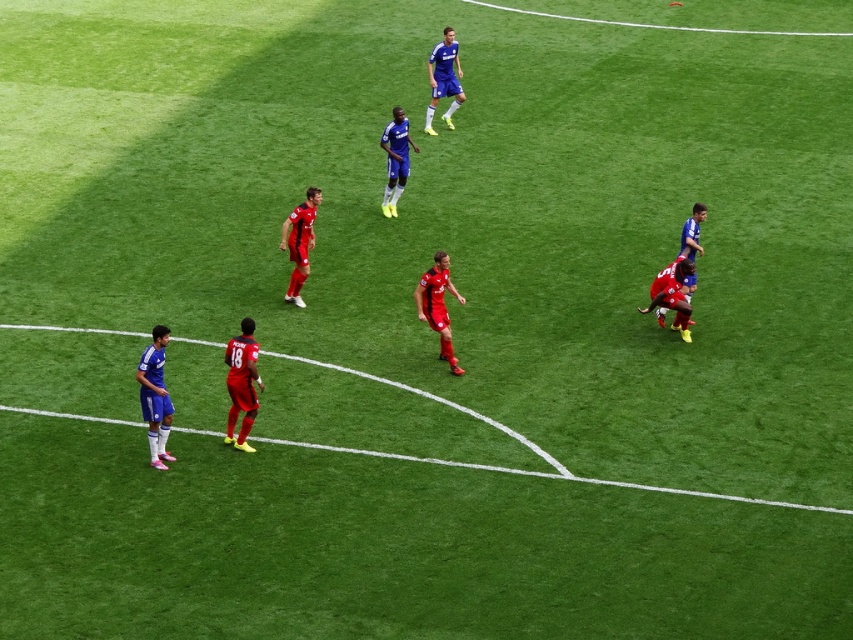
Question: Is blue jersey at lower left below shiny red soccer player at center?

Choices:
 (A) yes
 (B) no

Answer: (A)

Question: Is shiny red jersey at center below matte blue soccer player at center?

Choices:
 (A) yes
 (B) no

Answer: (A)

Question: From the image, what is the correct spatial relationship of shiny red jersey at center in relation to shiny red soccer player at center?

Choices:
 (A) left
 (B) right

Answer: (B)

Question: Which point is closer to the camera?

Choices:
 (A) (236, 417)
 (B) (434, 285)

Answer: (A)

Question: Which point is closer to the camera?

Choices:
 (A) shiny red shorts at center
 (B) matte blue soccer player at center
 (C) shiny red shorts at lower left
 (D) shiny red soccer player at center

Answer: (A)

Question: Estimate the real-world distances between objects in this image. Which object is farther from the shiny red soccer player at center?

Choices:
 (A) blue jersey at lower left
 (B) blue matte jersey at upper center
 (C) shiny red jersey at center

Answer: (B)